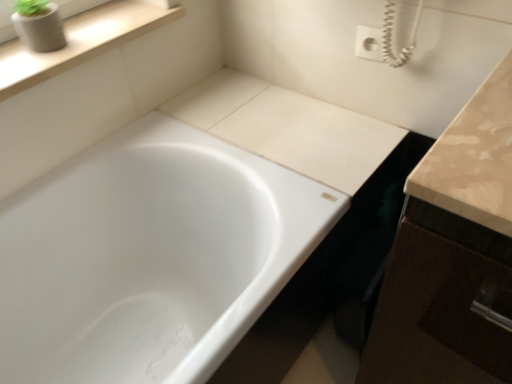
Question: Looking at their shapes, would you say matte gray concrete planter at upper left is wider or thinner than white glossy bathtub at center?

Choices:
 (A) wide
 (B) thin

Answer: (B)

Question: In the image, is matte gray concrete planter at upper left on the left side or the right side of white glossy bathtub at center?

Choices:
 (A) right
 (B) left

Answer: (B)

Question: Estimate the real-world distances between objects in this image. Which object is farther from the matte gray concrete planter at upper left?

Choices:
 (A) white glossy bathtub at center
 (B) wooden at upper left

Answer: (A)

Question: Which is farther from the matte gray concrete planter at upper left?

Choices:
 (A) white glossy bathtub at center
 (B) wooden at upper left

Answer: (A)